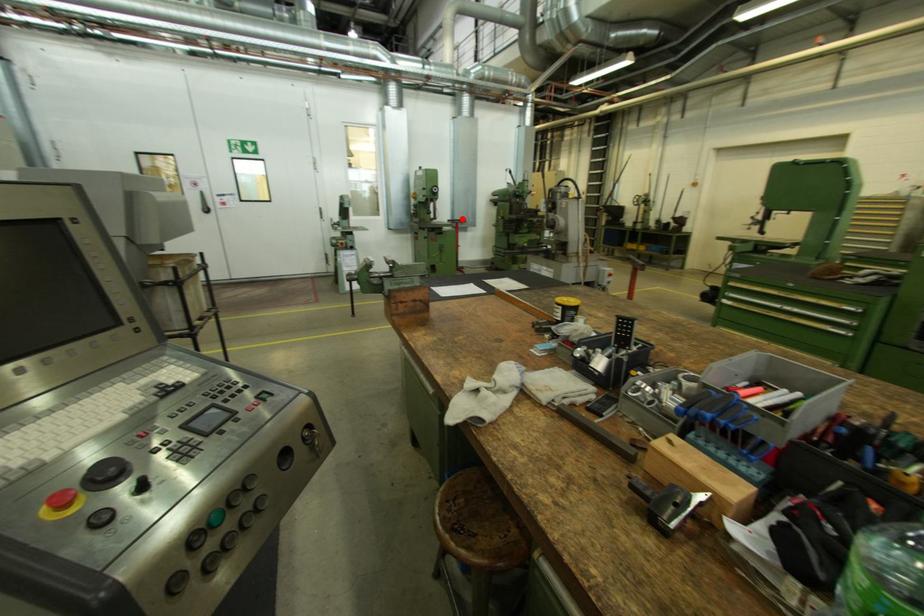
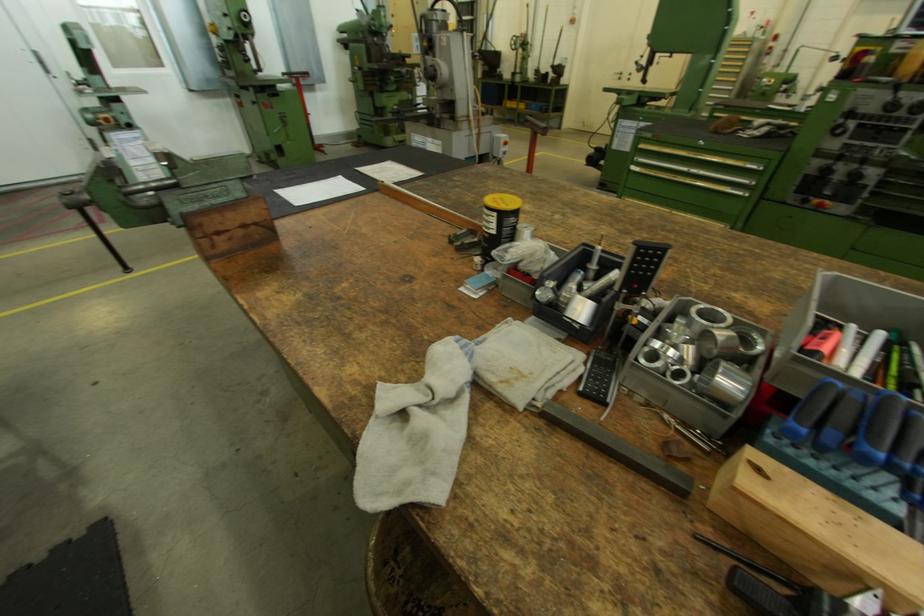
In the second image, find the point that corresponds to the highlighted location in the first image.

(299, 71)